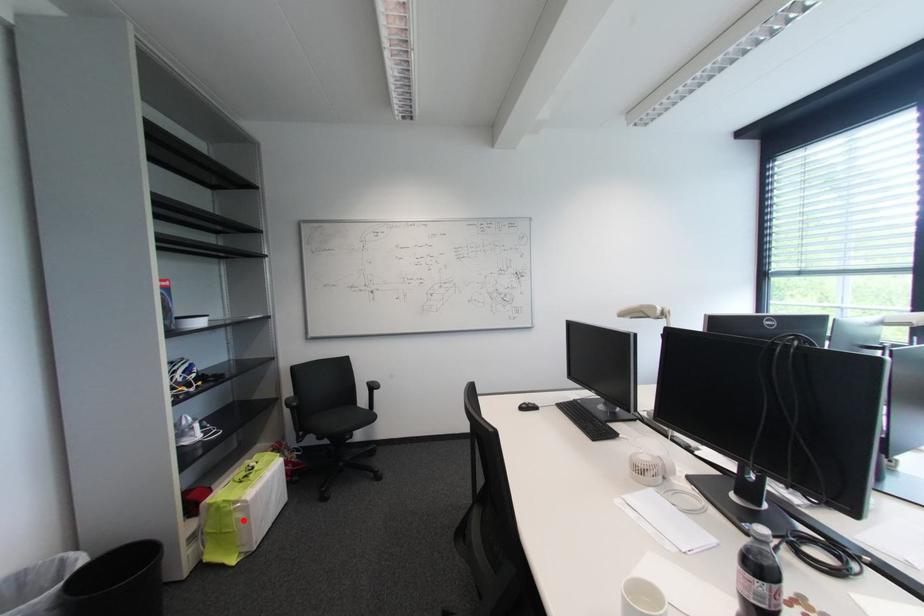
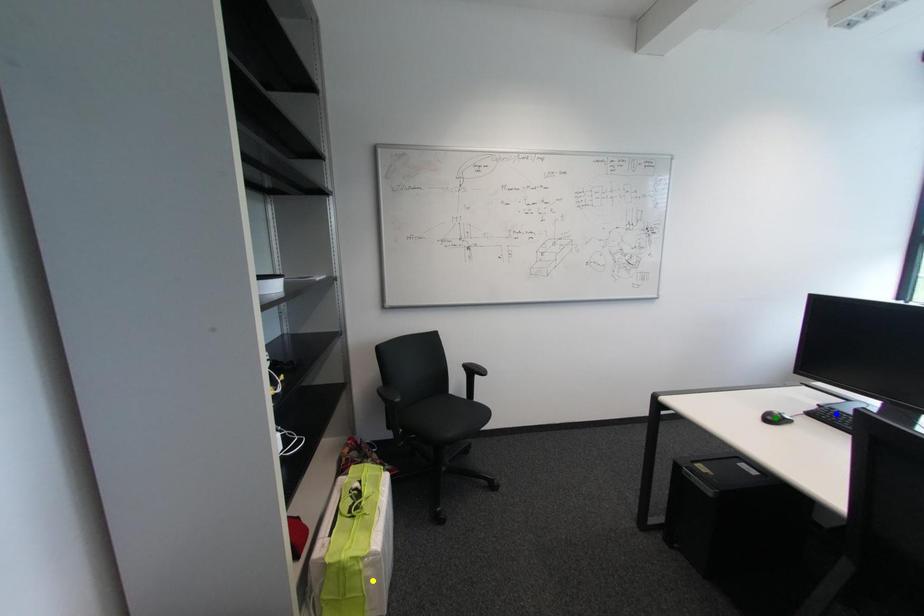
Question: I am providing you with two images of the same scene from different viewpoints. A red point is marked on the first image. You are given multiple points on the second image. Which spot in image 2 lines up with the point in image 1?

Choices:
 (A) green point
 (B) blue point
 (C) yellow point

Answer: (C)